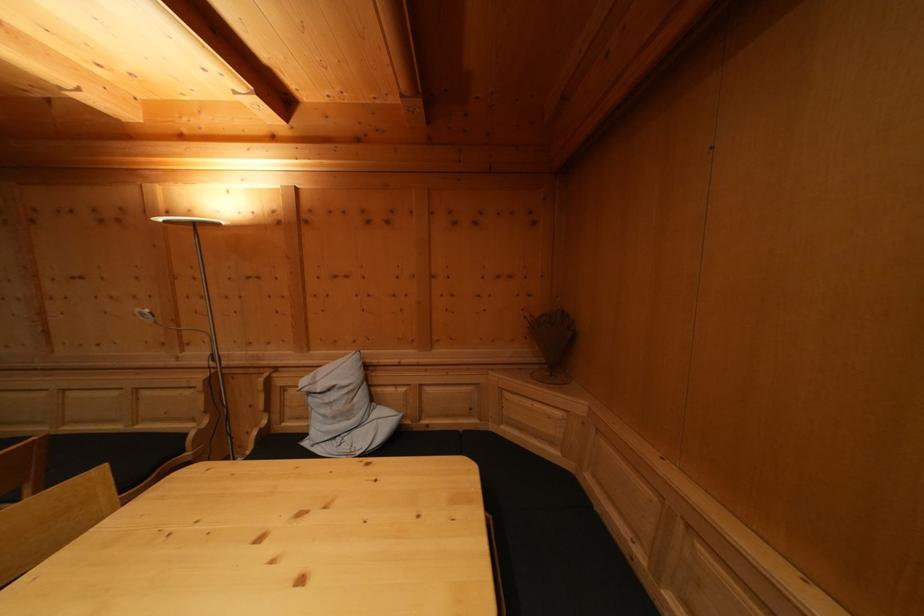
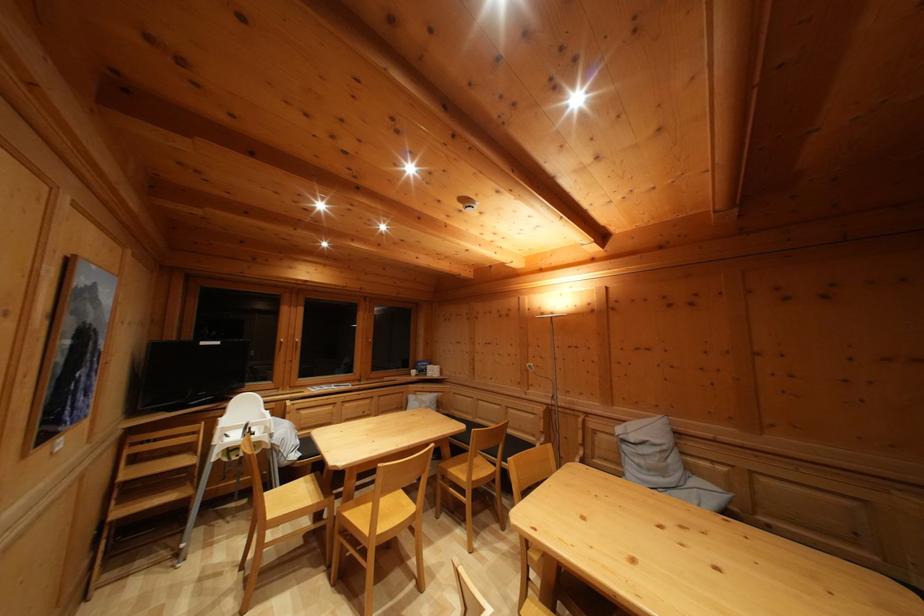
The point at (317, 407) is marked in the first image. Where is the corresponding point in the second image?

(629, 454)